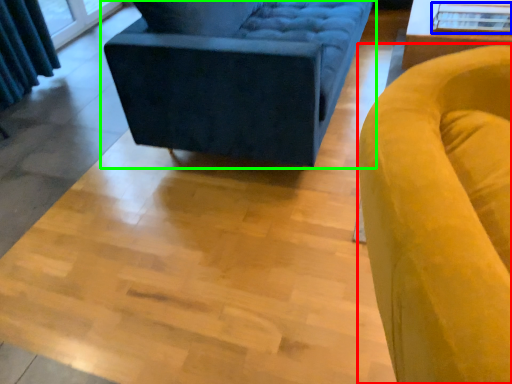
Question: Estimate the real-world distances between objects in this image. Which object is farther from chair (highlighted by a red box), glass table (highlighted by a blue box) or studio couch (highlighted by a green box)?

Choices:
 (A) glass table
 (B) studio couch

Answer: (A)